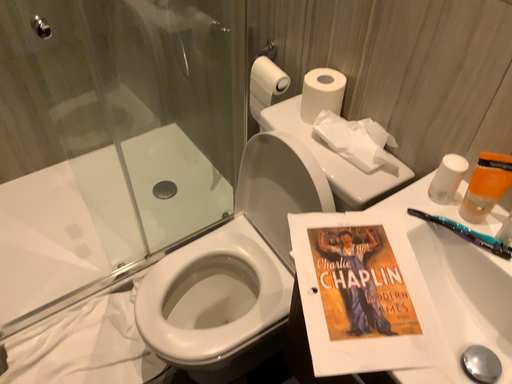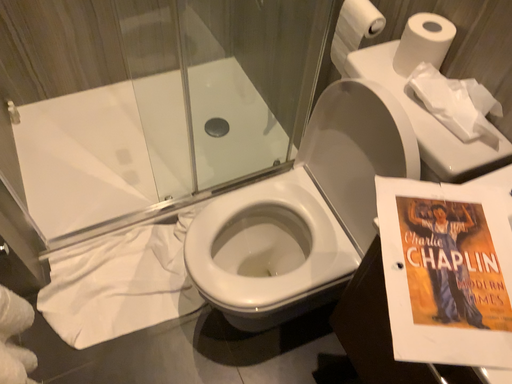
Question: How did the camera likely rotate when shooting the video?

Choices:
 (A) rotated downward
 (B) rotated upward

Answer: (A)